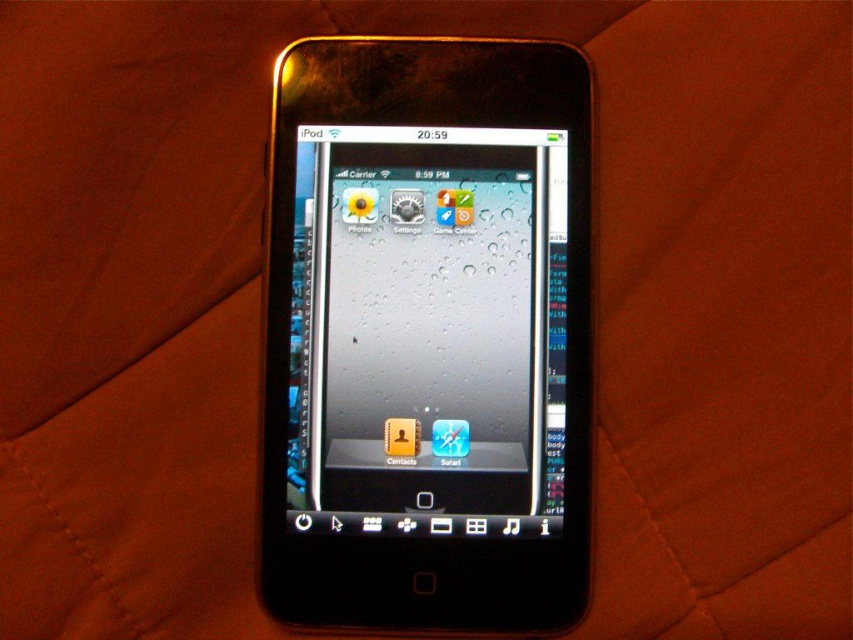
You are holding a black glossy smartphone at center and want to place it on a table that is 1.02 meters away. Can you reach it without moving your feet?

The distance between you and the table is 1.02 meters. The average human arm length is about 0.7 meters, so you cannot reach the table without moving your feet.

You are holding a black glossy smartphone at center and a glossy plastic screen at center. Which one is positioned to the right side?

The black glossy smartphone at center is positioned to the right of the glossy plastic screen at center.